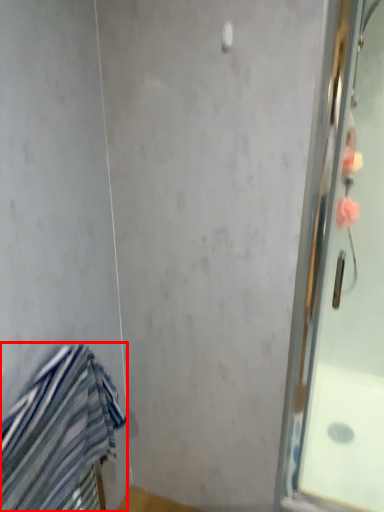
Question: Considering the relative positions of towel (annotated by the red box) and screen door in the image provided, where is towel (annotated by the red box) located with respect to the staircase?

Choices:
 (A) right
 (B) left

Answer: (B)